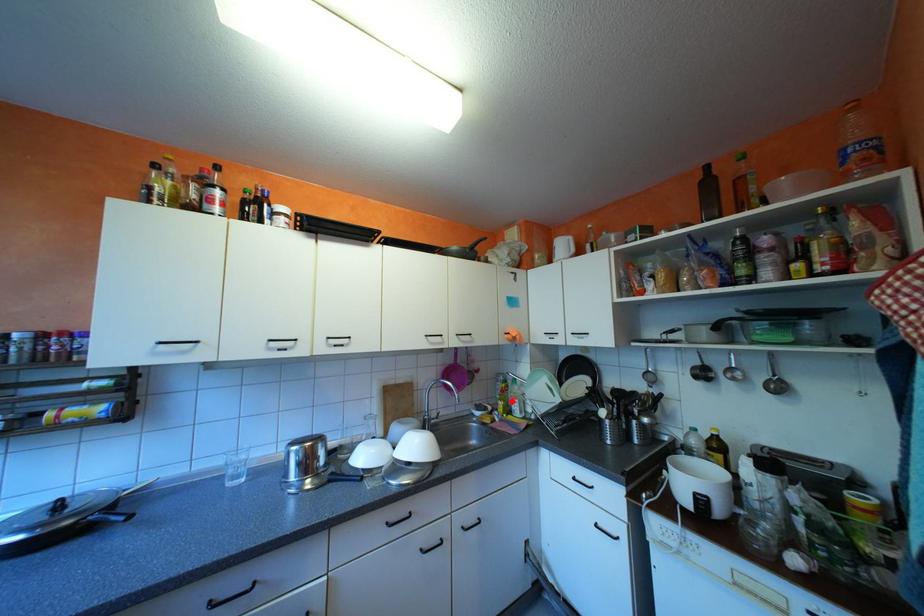
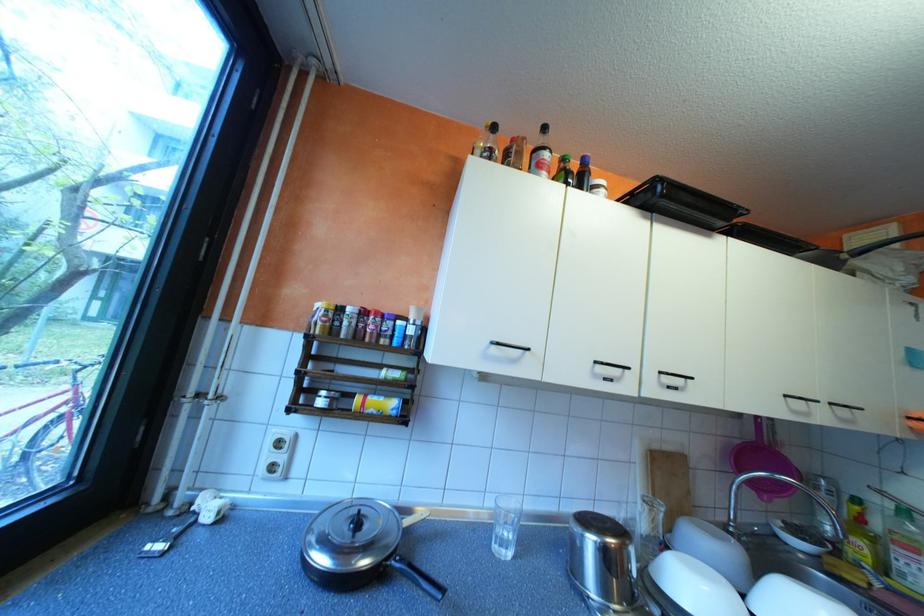
Question: I am providing you with two images of the same scene from different viewpoints. Image1 has a red point marked. In image2, the corresponding 3D location appears at what relative position? Reply with the corresponding letter.

Choices:
 (A) Closer
 (B) Farther

Answer: (A)